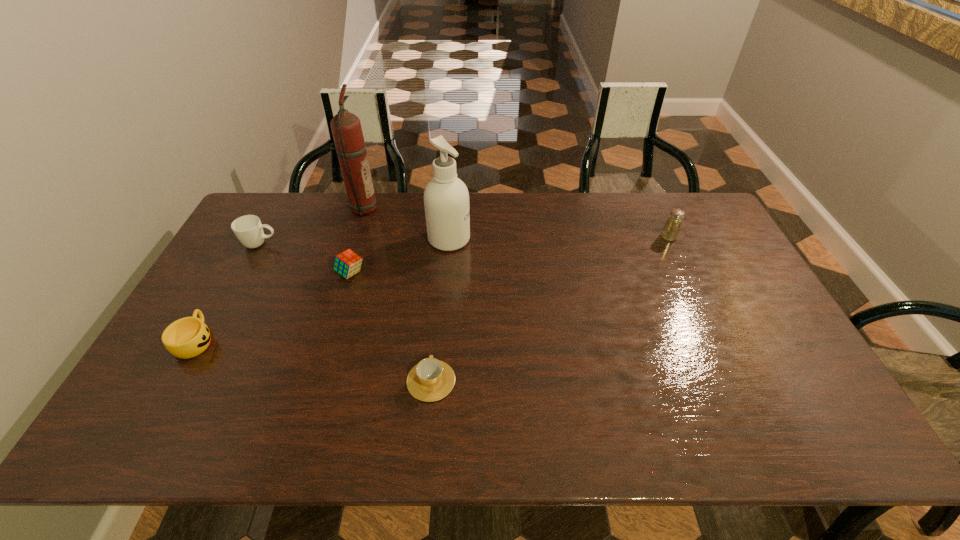
I want to click on object that is the sixth closest to the sixth shortest object, so click(670, 232).

In order to click on cup that is the closest to the fifth farthest object in this screenshot , I will do `click(248, 229)`.

Select which cup is the closest to the rightmost cup. Please provide its 2D coordinates. Your answer should be formatted as a tuple, i.e. [(x, y)], where the tuple contains the x and y coordinates of a point satisfying the conditions above.

[(188, 337)]

Identify the location of vacant space that satisfies the following two spatial constraints: 1. with the handle on the side of the rightmost cup; 2. with the handle on the side of the tallest cup. The height and width of the screenshot is (540, 960). (444, 244).

Find the location of a particular element. This screenshot has height=540, width=960. vacant area that satisfies the following two spatial constraints: 1. with the handle on the side of the farthest cup; 2. with the handle on the side of the rightmost cup is located at coordinates (187, 381).

Identify the location of free point that satisfies the following two spatial constraints: 1. with the handle on the side of the tallest cup; 2. on the back side of the cube. click(x=245, y=273).

What are the coordinates of `vacant area that satisfies the following two spatial constraints: 1. on the side of the fire extinguisher with the label and nozzle; 2. on the right side of the fifth farthest object` in the screenshot? It's located at [341, 273].

Locate an element on the screen. This screenshot has width=960, height=540. free space that satisfies the following two spatial constraints: 1. with the handle on the side of the tallest cup; 2. on the back side of the cube is located at coordinates (245, 273).

The image size is (960, 540). I want to click on free location that satisfies the following two spatial constraints: 1. with the handle on the side of the rightmost cup; 2. on the left side of the saltshaker, so click(x=444, y=237).

Image resolution: width=960 pixels, height=540 pixels. Find the location of `vacant space that satisfies the following two spatial constraints: 1. on the back side of the third tallest object; 2. on the side of the farthest object with the label and nozzle`. vacant space that satisfies the following two spatial constraints: 1. on the back side of the third tallest object; 2. on the side of the farthest object with the label and nozzle is located at coordinates (656, 209).